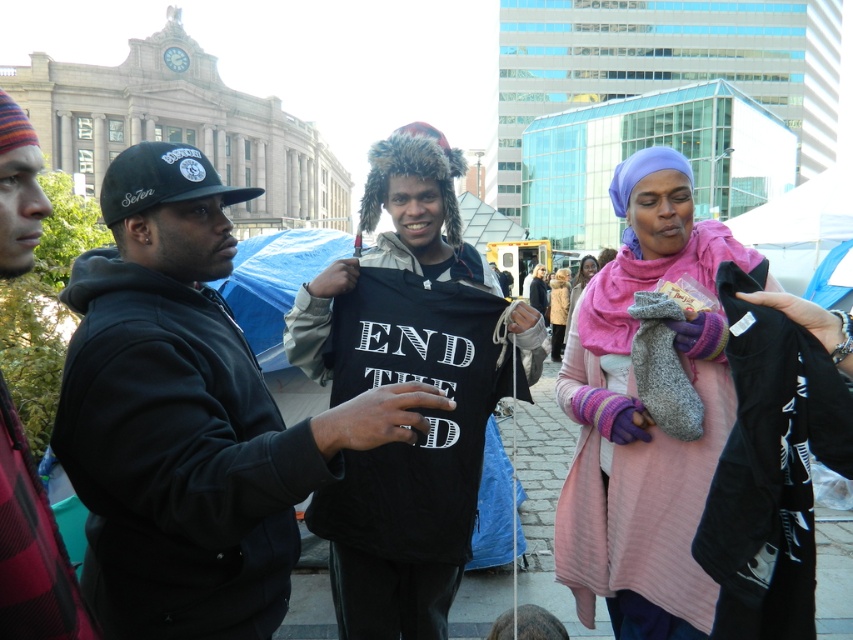
Consider the image. You are a photographer standing at the center of the scene. You want to take a photo that includes both the black matte hoodie at center and the pink woolen scarf at center. The camera you are using has a maximum focus range of 70 feet. Will both objects be in focus?

The black matte hoodie at center is 69.80 feet away from the pink woolen scarf at center. Since the maximum focus range of the camera is 70 feet, both objects will be within the focus range and thus in focus.

You are a photographer standing at the center of the scene. You want to take a photo that includes both the black matte sweatshirt at center and the plaid fabric shirt at left. Given that your camera has a maximum focus range of 20 meters, will you be able to capture both subjects in focus?

The black matte sweatshirt at center is 21.01 meters away from the plaid fabric shirt at left. Since the distance between them exceeds the camera maximum focus range of 20 meters, you will not be able to capture both subjects in focus.